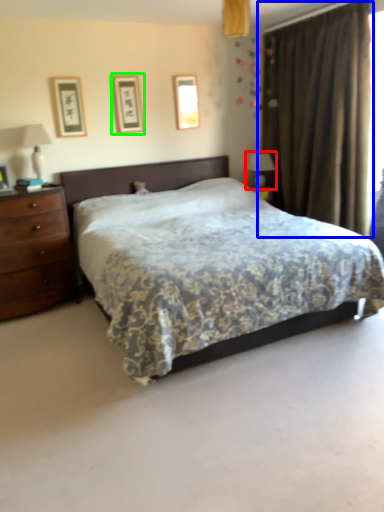
Question: Based on their relative distances, which object is farther from table lamp (highlighted by a red box)? Choose from curtain (highlighted by a blue box) and picture frame (highlighted by a green box).

Choices:
 (A) curtain
 (B) picture frame

Answer: (B)